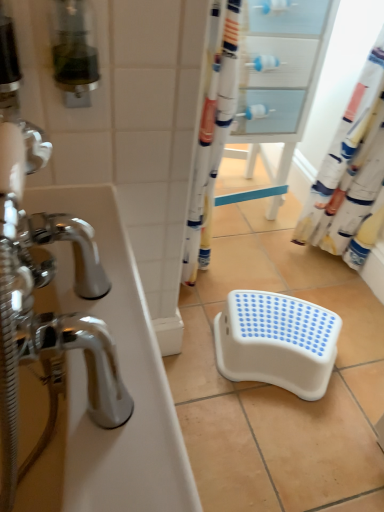
Identify the location of free space to the left of white plastic step stool at center. The width and height of the screenshot is (384, 512). (198, 349).